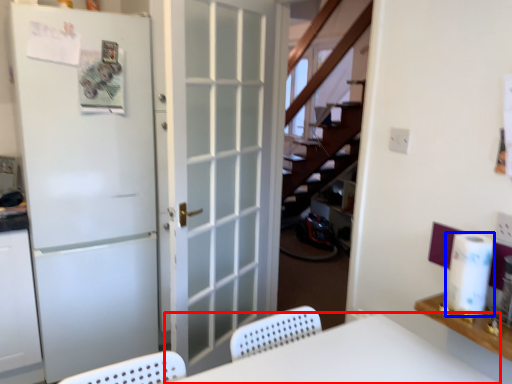
Question: Which of the following is the closest to the observer, furniture (highlighted by a red box) or paper towel (highlighted by a blue box)?

Choices:
 (A) furniture
 (B) paper towel

Answer: (A)